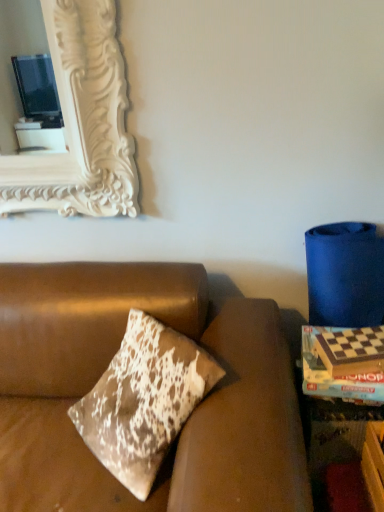
Question: Can you confirm if brown leather couch at center is positioned to the right of wooden checkered game board at right?

Choices:
 (A) no
 (B) yes

Answer: (A)

Question: Is brown leather couch at center bigger than wooden checkered game board at right?

Choices:
 (A) no
 (B) yes

Answer: (B)

Question: Is brown leather couch at center completely or partially outside of wooden checkered game board at right?

Choices:
 (A) yes
 (B) no

Answer: (A)

Question: Does brown leather couch at center have a greater width compared to wooden checkered game board at right?

Choices:
 (A) no
 (B) yes

Answer: (B)

Question: Considering the relative sizes of brown leather couch at center and wooden checkered game board at right in the image provided, is brown leather couch at center smaller than wooden checkered game board at right?

Choices:
 (A) yes
 (B) no

Answer: (B)

Question: Is brown leather couch at center shorter than wooden checkered game board at right?

Choices:
 (A) no
 (B) yes

Answer: (A)

Question: Is wooden checkered game board at right bigger than brown leather couch at center?

Choices:
 (A) no
 (B) yes

Answer: (A)

Question: Is brown leather couch at center at the back of wooden checkered game board at right?

Choices:
 (A) yes
 (B) no

Answer: (B)

Question: From the image's perspective, is wooden checkered game board at right located beneath brown leather couch at center?

Choices:
 (A) no
 (B) yes

Answer: (A)

Question: Does wooden checkered game board at right appear on the left side of brown leather couch at center?

Choices:
 (A) no
 (B) yes

Answer: (A)

Question: Is wooden checkered game board at right far from brown leather couch at center?

Choices:
 (A) no
 (B) yes

Answer: (A)

Question: Does wooden checkered game board at right lie in front of brown leather couch at center?

Choices:
 (A) no
 (B) yes

Answer: (A)

Question: From the image's perspective, is brown leather couch at center located above or below wooden checkered game board at right?

Choices:
 (A) below
 (B) above

Answer: (A)